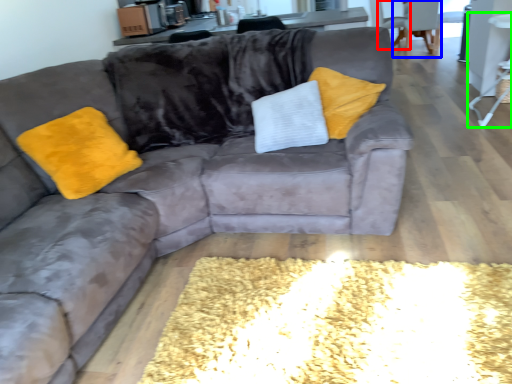
Question: Estimate the real-world distances between objects in this image. Which object is closer to armchair (highlighted by a red box), armchair (highlighted by a blue box) or side table (highlighted by a green box)?

Choices:
 (A) armchair
 (B) side table

Answer: (A)